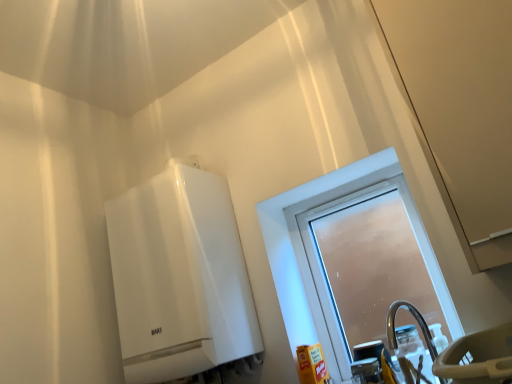
Question: Is transparent plastic screen door at upper right facing towards frosted glass window at center?

Choices:
 (A) yes
 (B) no

Answer: (B)

Question: Is transparent plastic screen door at upper right closer to camera compared to frosted glass window at center?

Choices:
 (A) no
 (B) yes

Answer: (B)

Question: From the image's perspective, does transparent plastic screen door at upper right appear lower than frosted glass window at center?

Choices:
 (A) no
 (B) yes

Answer: (A)

Question: Is transparent plastic screen door at upper right oriented away from frosted glass window at center?

Choices:
 (A) no
 (B) yes

Answer: (A)

Question: From a real-world perspective, is transparent plastic screen door at upper right positioned over frosted glass window at center based on gravity?

Choices:
 (A) yes
 (B) no

Answer: (A)

Question: In terms of size, does frosted glass window at center appear bigger or smaller than transparent plastic screen door at upper right?

Choices:
 (A) big
 (B) small

Answer: (B)

Question: From the image's perspective, is frosted glass window at center above or below transparent plastic screen door at upper right?

Choices:
 (A) below
 (B) above

Answer: (A)

Question: Considering their positions, is frosted glass window at center located in front of or behind transparent plastic screen door at upper right?

Choices:
 (A) front
 (B) behind

Answer: (B)

Question: Based on their positions, is frosted glass window at center located to the left or right of transparent plastic screen door at upper right?

Choices:
 (A) right
 (B) left

Answer: (B)

Question: Considering the relative positions of translucent plastic bottle at lower right and transparent plastic screen door at upper right in the image provided, is translucent plastic bottle at lower right to the left or to the right of transparent plastic screen door at upper right?

Choices:
 (A) right
 (B) left

Answer: (B)

Question: Considering the positions of translucent plastic bottle at lower right and transparent plastic screen door at upper right in the image, is translucent plastic bottle at lower right taller or shorter than transparent plastic screen door at upper right?

Choices:
 (A) tall
 (B) short

Answer: (B)

Question: Relative to transparent plastic screen door at upper right, is translucent plastic bottle at lower right in front or behind?

Choices:
 (A) behind
 (B) front

Answer: (A)

Question: From the image's perspective, is translucent plastic bottle at lower right above or below transparent plastic screen door at upper right?

Choices:
 (A) below
 (B) above

Answer: (A)

Question: From the image's perspective, is white glossy water heater at upper left positioned above or below frosted glass window at center?

Choices:
 (A) above
 (B) below

Answer: (A)

Question: Does point (141, 218) appear closer or farther from the camera than point (317, 319)?

Choices:
 (A) closer
 (B) farther

Answer: (A)